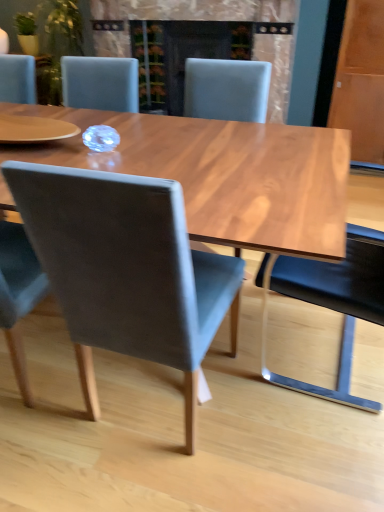
Where is `matte gray chair at center, the second chair viewed from the right`? This screenshot has width=384, height=512. matte gray chair at center, the second chair viewed from the right is located at coordinates (226, 89).

You are a GUI agent. You are given a task and a screenshot of the screen. Output one action in this format:
    pyautogui.click(x=<x>, y=<y>)
    Task: Click on the black leather chair at right, which ranks as the 1th chair in right-to-left order
    This screenshot has width=384, height=512.
    Given the screenshot: What is the action you would take?
    pyautogui.click(x=332, y=301)

You are a GUI agent. You are given a task and a screenshot of the screen. Output one action in this format:
    pyautogui.click(x=<x>, y=<y>)
    Task: Click on the velvet grey chair at center, the second chair viewed from the left
    Image resolution: width=384 pixels, height=512 pixels.
    Given the screenshot: What is the action you would take?
    pyautogui.click(x=126, y=269)

Image resolution: width=384 pixels, height=512 pixels. I want to click on matte gray chair at center, the 3th chair positioned from the left, so click(226, 89).

How many degrees apart are the facing directions of matte gray chair at center, the second chair viewed from the right, and black leather chair at right, which ranks as the 1th chair in right-to-left order?

90.2 degrees.

From the picture: Is matte gray chair at center, the 3th chair positioned from the left, bigger or smaller than black leather chair at right, which ranks as the 1th chair in right-to-left order?

Clearly, matte gray chair at center, the 3th chair positioned from the left, is smaller in size than black leather chair at right, which ranks as the 1th chair in right-to-left order.

Is matte gray chair at center, the second chair viewed from the right, positioned in front of black leather chair at right, which ranks as the 1th chair in right-to-left order?

No, the depth of matte gray chair at center, the second chair viewed from the right, is greater than that of black leather chair at right, which ranks as the 1th chair in right-to-left order.

Which of these two, matte gray chair at center, the second chair viewed from the right, or black leather chair at right, which ranks as the 1th chair in right-to-left order, is thinner?

With smaller width is black leather chair at right, which ranks as the 1th chair in right-to-left order.

There is a black leather chair at right, which is the 4th chair from left to right. Where is `the 3rd chair above it (from a real-world perspective)`? This screenshot has width=384, height=512. the 3rd chair above it (from a real-world perspective) is located at coordinates [x=18, y=294].

Between matte gray chair at center, which is the first chair from left to right, and black leather chair at right, which ranks as the 1th chair in right-to-left order, which one has smaller size?

matte gray chair at center, which is the first chair from left to right, is smaller.

Considering the sizes of matte gray chair at center, which is the first chair from left to right, and black leather chair at right, which is the 4th chair from left to right, in the image, is matte gray chair at center, which is the first chair from left to right, wider or thinner than black leather chair at right, which is the 4th chair from left to right,?

Considering their sizes, matte gray chair at center, which is the first chair from left to right, looks slimmer than black leather chair at right, which is the 4th chair from left to right.

Which object is thinner, black leather chair at right, which is the 4th chair from left to right, or velvet grey chair at center, which is counted as the 3th chair, starting from the right?

With smaller width is velvet grey chair at center, which is counted as the 3th chair, starting from the right.

Between black leather chair at right, which is the 4th chair from left to right, and velvet grey chair at center, which is counted as the 3th chair, starting from the right, which one is positioned behind?

black leather chair at right, which is the 4th chair from left to right, is more distant.

Does black leather chair at right, which is the 4th chair from left to right, touch velvet grey chair at center, the second chair viewed from the left?

black leather chair at right, which is the 4th chair from left to right, and velvet grey chair at center, the second chair viewed from the left, are not in contact.

From a real-world perspective, is black leather chair at right, which ranks as the 1th chair in right-to-left order, on top of velvet grey chair at center, the second chair viewed from the left?

Incorrect, from a real-world perspective, black leather chair at right, which ranks as the 1th chair in right-to-left order, is lower than velvet grey chair at center, the second chair viewed from the left.

Between point (269, 377) and point (268, 87), which one is positioned in front?

Point (269, 377)

Between black leather chair at right, which ranks as the 1th chair in right-to-left order, and matte gray chair at center, the 3th chair positioned from the left, which one has larger width?

With larger width is matte gray chair at center, the 3th chair positioned from the left.

From a real-world perspective, is black leather chair at right, which is the 4th chair from left to right, on top of matte gray chair at center, the second chair viewed from the right?

No, from a real-world perspective, black leather chair at right, which is the 4th chair from left to right, is not over matte gray chair at center, the second chair viewed from the right

Which of these two, black leather chair at right, which ranks as the 1th chair in right-to-left order, or matte gray chair at center, the 3th chair positioned from the left, stands shorter?

black leather chair at right, which ranks as the 1th chair in right-to-left order, is shorter.

Can you confirm if matte gray chair at center, the 4th chair from the right, is wider than velvet grey chair at center, the second chair viewed from the left?

No.

From the picture: Is matte gray chair at center, the 4th chair from the right, far from velvet grey chair at center, which is counted as the 3th chair, starting from the right?

No, matte gray chair at center, the 4th chair from the right, is in close proximity to velvet grey chair at center, which is counted as the 3th chair, starting from the right.

How much distance is there between matte gray chair at center, the 4th chair from the right, and velvet grey chair at center, which is counted as the 3th chair, starting from the right?

17.20 inches.

How different are the orientations of velvet grey chair at center, the second chair viewed from the left, and matte black fireplace at center in degrees?

179 degrees separate the facing orientations of velvet grey chair at center, the second chair viewed from the left, and matte black fireplace at center.

Does point (134, 262) come behind point (125, 46)?

No, it is in front of (125, 46).

From a real-world perspective, between velvet grey chair at center, the second chair viewed from the left, and matte black fireplace at center, who is vertically lower?

In real-world perspective, velvet grey chair at center, the second chair viewed from the left, is lower.

Which of these two, black leather chair at right, which is the 4th chair from left to right, or matte black fireplace at center, is wider?

matte black fireplace at center is wider.

Would you say black leather chair at right, which is the 4th chair from left to right, is inside or outside matte black fireplace at center?

black leather chair at right, which is the 4th chair from left to right, is outside matte black fireplace at center.

Is black leather chair at right, which ranks as the 1th chair in right-to-left order, next to matte black fireplace at center and touching it?

black leather chair at right, which ranks as the 1th chair in right-to-left order, and matte black fireplace at center are not in contact.

Could you tell me if black leather chair at right, which ranks as the 1th chair in right-to-left order, is facing matte black fireplace at center?

No, black leather chair at right, which ranks as the 1th chair in right-to-left order, is not aimed at matte black fireplace at center.

I want to click on chair below the matte gray chair at center, the second chair viewed from the right (from a real-world perspective), so click(332, 301).

Locate an element on the screen. The image size is (384, 512). chair that is the 1st one when counting backward from the matte gray chair at center, which is the first chair from left to right is located at coordinates (332, 301).

When comparing their distances from matte gray chair at center, the 3th chair positioned from the left, does matte black fireplace at center or black leather chair at right, which ranks as the 1th chair in right-to-left order, seem further?

Among the two, matte black fireplace at center is located further to matte gray chair at center, the 3th chair positioned from the left.

Which object lies further to the anchor point black leather chair at right, which is the 4th chair from left to right, velvet grey chair at center, the second chair viewed from the left, or matte black fireplace at center?

Based on the image, matte black fireplace at center appears to be further to black leather chair at right, which is the 4th chair from left to right.

Estimate the real-world distances between objects in this image. Which object is closer to velvet grey chair at center, which is counted as the 3th chair, starting from the right, matte gray chair at center, which is the first chair from left to right, or matte black fireplace at center?

Among the two, matte gray chair at center, which is the first chair from left to right, is located nearer to velvet grey chair at center, which is counted as the 3th chair, starting from the right.

From the image, which object appears to be nearer to matte gray chair at center, which is the first chair from left to right, matte black fireplace at center or matte gray chair at center, the second chair viewed from the right?

matte gray chair at center, the second chair viewed from the right, lies closer to matte gray chair at center, which is the first chair from left to right, than the other object.

Based on their spatial positions, is matte gray chair at center, the second chair viewed from the right, or matte gray chair at center, which is the first chair from left to right, further from velvet grey chair at center, which is counted as the 3th chair, starting from the right?

matte gray chair at center, the second chair viewed from the right.

Looking at the image, which one is located closer to matte black fireplace at center, matte gray chair at center, the 3th chair positioned from the left, or velvet grey chair at center, which is counted as the 3th chair, starting from the right?

matte gray chair at center, the 3th chair positioned from the left, is closer to matte black fireplace at center.

Looking at the image, which one is located closer to matte gray chair at center, which is the first chair from left to right, matte black fireplace at center or black leather chair at right, which ranks as the 1th chair in right-to-left order?

black leather chair at right, which ranks as the 1th chair in right-to-left order, is positioned closer to the anchor matte gray chair at center, which is the first chair from left to right.

From the picture: Which object lies nearer to the anchor point matte black fireplace at center, black leather chair at right, which ranks as the 1th chair in right-to-left order, or matte gray chair at center, the 3th chair positioned from the left?

matte gray chair at center, the 3th chair positioned from the left, is positioned closer to the anchor matte black fireplace at center.

Identify the location of chair located between black leather chair at right, which is the 4th chair from left to right, and matte black fireplace at center in the depth direction. This screenshot has width=384, height=512. (226, 89).

I want to click on chair between matte gray chair at center, which is the first chair from left to right, and matte gray chair at center, the 3th chair positioned from the left, from left to right, so click(126, 269).